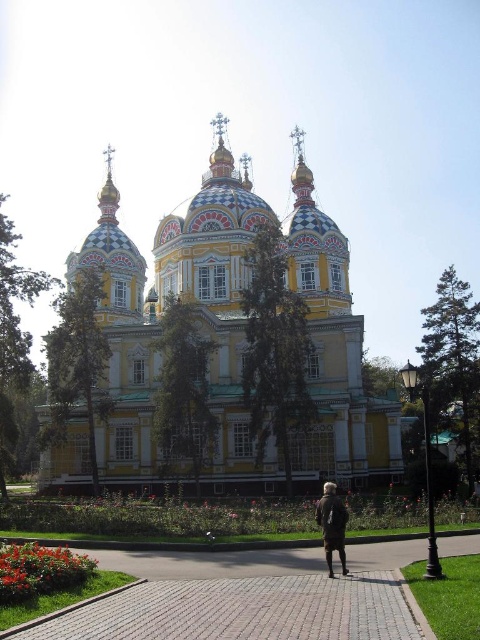
Is painted wood church at center bigger than dark brown fur coat at center?

Yes.

Is point (206, 192) positioned in front of point (339, 560)?

No, it is behind (339, 560).

Image resolution: width=480 pixels, height=640 pixels. In order to click on painted wood church at center in this screenshot , I will do `click(157, 323)`.

Does brick paved walkway at lower center have a greater width compared to dark brown fur coat at center?

Correct, the width of brick paved walkway at lower center exceeds that of dark brown fur coat at center.

Between brick paved walkway at lower center and dark brown fur coat at center, which one has less height?

brick paved walkway at lower center

This screenshot has width=480, height=640. Describe the element at coordinates (239, 611) in the screenshot. I see `brick paved walkway at lower center` at that location.

The width and height of the screenshot is (480, 640). I want to click on brick paved walkway at lower center, so click(x=239, y=611).

Measure the distance between painted wood church at center and camera.

painted wood church at center is 81.89 meters from camera.

Does painted wood church at center have a lesser width compared to brick paved walkway at lower center?

In fact, painted wood church at center might be wider than brick paved walkway at lower center.

Where is `painted wood church at center`? The image size is (480, 640). painted wood church at center is located at coordinates (157, 323).